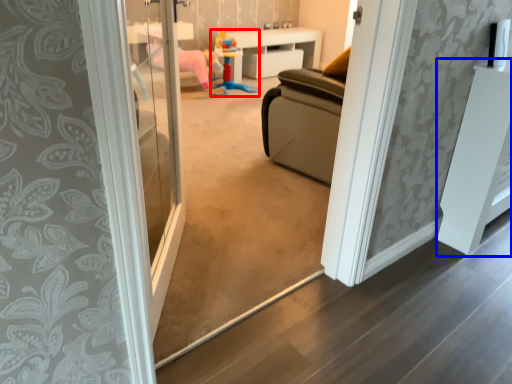
Question: Which of the following is the closest to the observer, toy (highlighted by a red box) or furniture (highlighted by a blue box)?

Choices:
 (A) toy
 (B) furniture

Answer: (B)